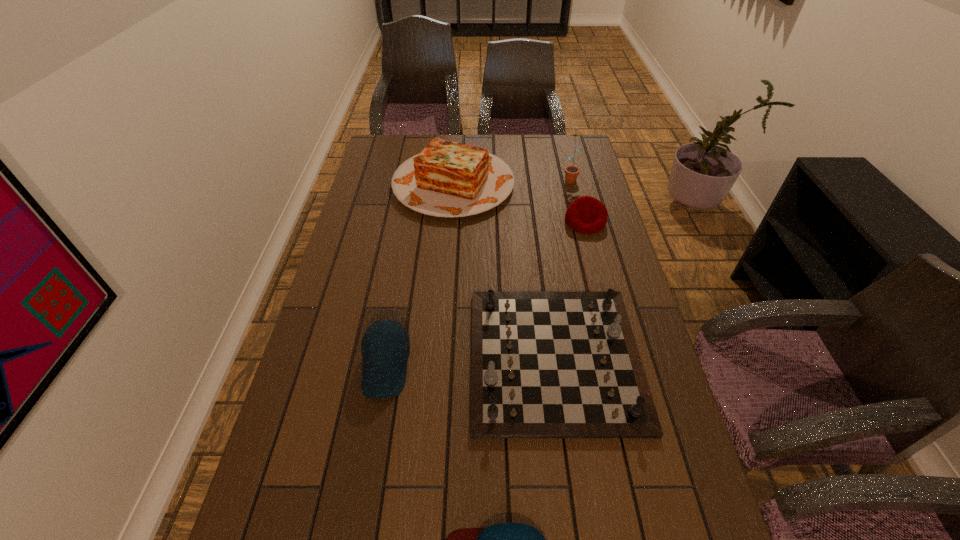
The width and height of the screenshot is (960, 540). I want to click on free space that satisfies the following two spatial constraints: 1. on the board of the chessboard; 2. on the front-facing side of the left baseball cap, so click(556, 367).

Image resolution: width=960 pixels, height=540 pixels. What are the coordinates of `vacant area that satisfies the following two spatial constraints: 1. on the board of the chessboard; 2. on the front-facing side of the left baseball cap` in the screenshot? It's located at (556, 367).